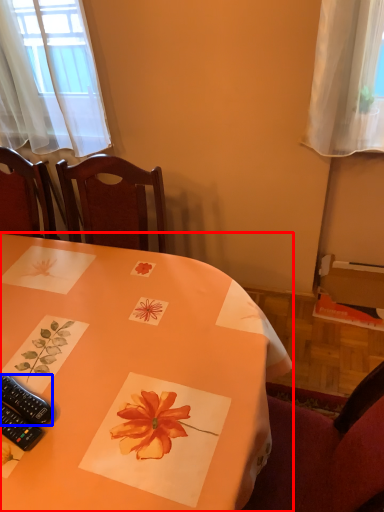
Question: Which of the following is the farthest to the observer, table (highlighted by a red box) or remote control (highlighted by a blue box)?

Choices:
 (A) table
 (B) remote control

Answer: (B)